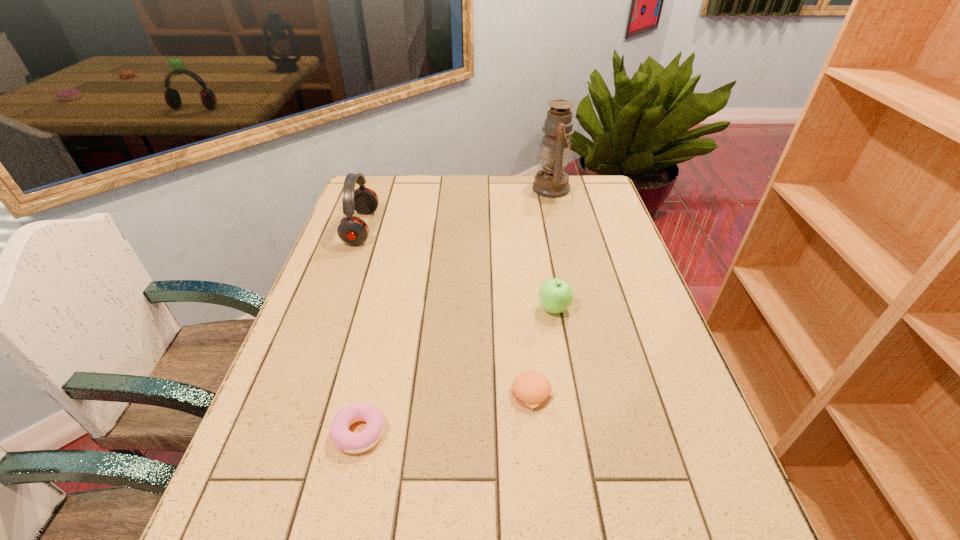
Locate an element on the screen. The image size is (960, 540). free space at the far edge is located at coordinates (408, 174).

What are the coordinates of `vacant area at the left edge of the desktop` in the screenshot? It's located at (324, 354).

Locate an element on the screen. The image size is (960, 540). free space at the right edge of the desktop is located at coordinates (616, 241).

In the image, there is a desktop. At what (x,y) coordinates should I click in order to perform the action: click on blank space at the near right corner. Please return your answer as a coordinate pair (x, y). The height and width of the screenshot is (540, 960). Looking at the image, I should click on (718, 534).

Where is `free spot between the fourth object from right to left and the farthest object`? free spot between the fourth object from right to left and the farthest object is located at coordinates (456, 310).

At what (x,y) coordinates should I click in order to perform the action: click on unoccupied area between the farthest object and the second farthest object. Please return your answer as a coordinate pair (x, y). Looking at the image, I should click on click(458, 208).

Image resolution: width=960 pixels, height=540 pixels. I want to click on vacant area between the patty and the third nearest object, so 543,350.

What are the coordinates of `vacant space that's between the apple and the second farthest object` in the screenshot? It's located at (458, 268).

In order to click on free space between the apple and the farthest object in this screenshot , I will do `click(554, 248)`.

Where is `empty space between the third shortest object and the oil lamp`? empty space between the third shortest object and the oil lamp is located at coordinates [x=554, y=248].